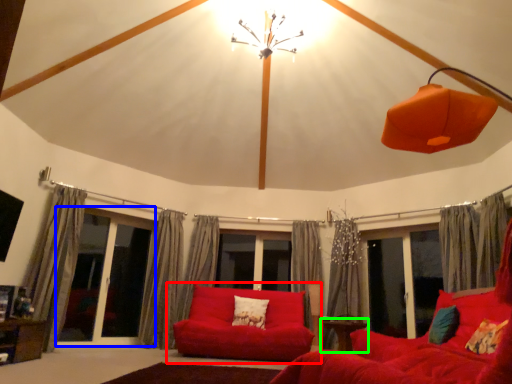
Question: Considering the real-world distances, which object is farthest from studio couch (highlighted by a red box)? screen door (highlighted by a blue box) or table (highlighted by a green box)?

Choices:
 (A) screen door
 (B) table

Answer: (A)